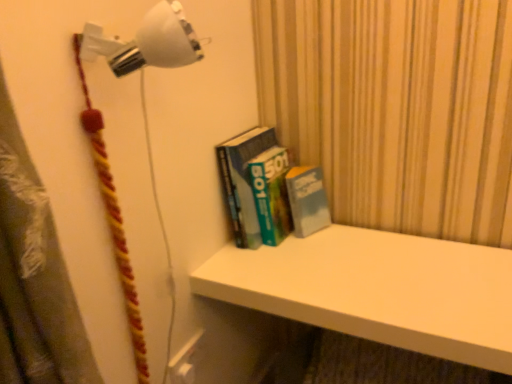
Find the location of a particular element. The width and height of the screenshot is (512, 384). vacant area on top of white matte shelf at upper center (from a real-world perspective) is located at coordinates (373, 273).